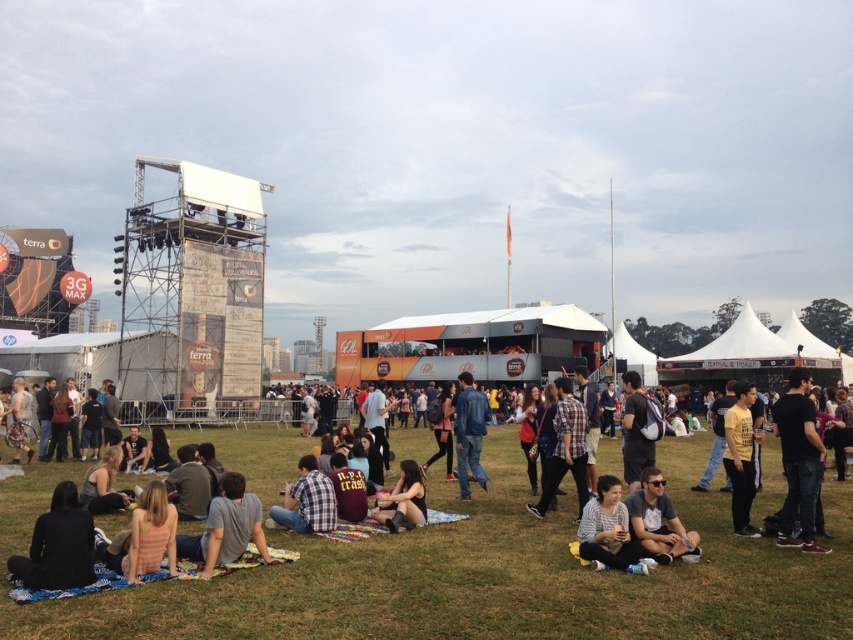
Who is shorter, black matte jacket at lower left or yellow matte shirt at center?

With less height is black matte jacket at lower left.

Can you confirm if black matte jacket at lower left is wider than yellow matte shirt at center?

In fact, black matte jacket at lower left might be narrower than yellow matte shirt at center.

Consider the image. Who is more distant from viewer, (57, 515) or (749, 532)?

Point (749, 532)

I want to click on black matte jacket at lower left, so click(57, 545).

Does denim jacket at lower left appear on the right side of dark gray casual wear at lower right?

Incorrect, denim jacket at lower left is not on the right side of dark gray casual wear at lower right.

Which is behind, point (213, 563) or point (659, 545)?

Point (659, 545)

Is point (259, 538) in front of point (672, 524)?

Yes, point (259, 538) is in front of point (672, 524).

This screenshot has height=640, width=853. I want to click on denim jacket at lower left, so click(207, 552).

Does black cotton shirt at right come behind black matte jacket at lower left?

Yes, it is behind black matte jacket at lower left.

Is black cotton shirt at right above black matte jacket at lower left?

Correct, black cotton shirt at right is located above black matte jacket at lower left.

This screenshot has height=640, width=853. What are the coordinates of `black cotton shirt at right` in the screenshot? It's located at (798, 461).

You are a GUI agent. You are given a task and a screenshot of the screen. Output one action in this format:
    pyautogui.click(x=<x>, y=<y>)
    Task: Click on the black cotton shirt at right
    
    Given the screenshot: What is the action you would take?
    pyautogui.click(x=798, y=461)